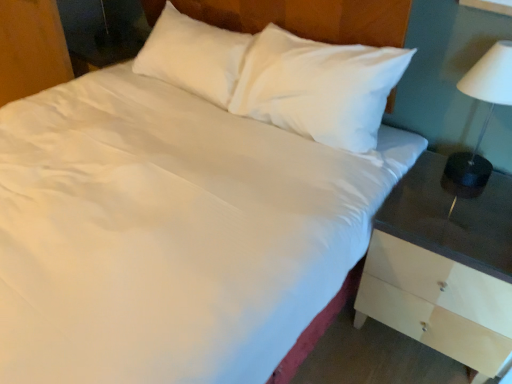
This screenshot has width=512, height=384. Find the location of `white glossy lampshade at right`. white glossy lampshade at right is located at coordinates (484, 121).

Where is `wooden dresser at lower left`? This screenshot has width=512, height=384. wooden dresser at lower left is located at coordinates (31, 48).

Where is `white glossy lampshade at right`? This screenshot has width=512, height=384. white glossy lampshade at right is located at coordinates (484, 121).

Can you tell me how much white wood nightstand at right and white glossy lampshade at right differ in facing direction?

white wood nightstand at right and white glossy lampshade at right are facing 2.71 degrees away from each other.

Is point (436, 266) positioned before point (476, 144)?

That is True.

Which object is positioned more to the left, white wood nightstand at right or white glossy lampshade at right?

From the viewer's perspective, white wood nightstand at right appears more on the left side.

Considering the sizes of objects white wood nightstand at right and white glossy lampshade at right in the image provided, who is bigger, white wood nightstand at right or white glossy lampshade at right?

With larger size is white wood nightstand at right.

Looking at this image, considering the relative sizes of wooden dresser at lower left and white wood nightstand at right in the image provided, is wooden dresser at lower left shorter than white wood nightstand at right?

In fact, wooden dresser at lower left may be taller than white wood nightstand at right.

How many degrees apart are the facing directions of wooden dresser at lower left and white wood nightstand at right?

wooden dresser at lower left and white wood nightstand at right are facing 2.45 degrees away from each other.

You are a GUI agent. You are given a task and a screenshot of the screen. Output one action in this format:
    pyautogui.click(x=<x>, y=<y>)
    Task: Click on the nightstand below the wooden dresser at lower left (from a real-world perspective)
    
    Given the screenshot: What is the action you would take?
    pyautogui.click(x=443, y=268)

From the image's perspective, is wooden dresser at lower left beneath white wood nightstand at right?

No, from the image's perspective, wooden dresser at lower left is not beneath white wood nightstand at right.

Would you consider white wood nightstand at right to be distant from wooden dresser at lower left?

Yes, white wood nightstand at right is far from wooden dresser at lower left.

Where is `dresser to the left of white wood nightstand at right`? dresser to the left of white wood nightstand at right is located at coordinates (31, 48).

Is white wood nightstand at right aimed at wooden dresser at lower left?

No, white wood nightstand at right is not oriented towards wooden dresser at lower left.

Looking at this image, do you think white wood nightstand at right is within wooden dresser at lower left, or outside of it?

white wood nightstand at right exists outside the volume of wooden dresser at lower left.

Considering the sizes of objects white glossy lampshade at right and white wood nightstand at right in the image provided, who is smaller, white glossy lampshade at right or white wood nightstand at right?

white glossy lampshade at right is smaller.

In the image, is white glossy lampshade at right positioned in front of or behind white wood nightstand at right?

white glossy lampshade at right is positioned farther from the viewer than white wood nightstand at right.

Based on the photo, is white glossy lampshade at right situated inside white wood nightstand at right or outside?

white glossy lampshade at right lies outside white wood nightstand at right.

Considering the positions of objects white glossy lampshade at right and white wood nightstand at right in the image provided, who is more to the right, white glossy lampshade at right or white wood nightstand at right?

white glossy lampshade at right is more to the right.

Can you see white glossy lampshade at right touching wooden dresser at lower left?

No.

From the image's perspective, between white glossy lampshade at right and wooden dresser at lower left, who is located below?

white glossy lampshade at right is shown below in the image.

Does point (503, 51) lie in front of point (31, 68)?

Yes.

Considering the sizes of objects white glossy lampshade at right and wooden dresser at lower left in the image provided, who is shorter, white glossy lampshade at right or wooden dresser at lower left?

white glossy lampshade at right.

Find the location of a particular element. Image resolution: width=512 pixels, height=384 pixels. dresser behind the white glossy lampshade at right is located at coordinates (31, 48).

Would you say wooden dresser at lower left is a long distance from white glossy lampshade at right?

Indeed, wooden dresser at lower left is not near white glossy lampshade at right.

Could you tell me if wooden dresser at lower left is facing white glossy lampshade at right?

No, wooden dresser at lower left is not turned towards white glossy lampshade at right.

Locate an element on the screen. This screenshot has width=512, height=384. nightstand in front of the white glossy lampshade at right is located at coordinates (443, 268).

Identify the location of nightstand that is on the right side of wooden dresser at lower left. The width and height of the screenshot is (512, 384). pyautogui.click(x=443, y=268).

Based on the photo, based on their spatial positions, is white wood nightstand at right or wooden dresser at lower left closer to white glossy lampshade at right?

The object closer to white glossy lampshade at right is white wood nightstand at right.

Consider the image. Considering their positions, is white wood nightstand at right positioned further to wooden dresser at lower left than white glossy lampshade at right?

Based on the image, white glossy lampshade at right appears to be further to wooden dresser at lower left.

Based on their spatial positions, is wooden dresser at lower left or white wood nightstand at right closer to white glossy lampshade at right?

The object closer to white glossy lampshade at right is white wood nightstand at right.

From the image, which object appears to be farther from white wood nightstand at right, white glossy lampshade at right or wooden dresser at lower left?

wooden dresser at lower left.

Which object lies nearer to the anchor point white wood nightstand at right, wooden dresser at lower left or white glossy lampshade at right?

Among the two, white glossy lampshade at right is located nearer to white wood nightstand at right.

Which object lies further to the anchor point wooden dresser at lower left, white glossy lampshade at right or white wood nightstand at right?

Among the two, white glossy lampshade at right is located further to wooden dresser at lower left.

The width and height of the screenshot is (512, 384). I want to click on nightstand located between wooden dresser at lower left and white glossy lampshade at right in the left-right direction, so click(443, 268).